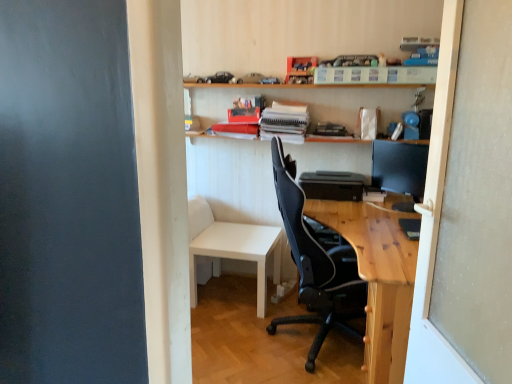
Measure the distance between white matte table at lower center and camera.

white matte table at lower center is 2.73 meters from camera.

Describe the element at coordinates (231, 247) in the screenshot. The image size is (512, 384). I see `white matte table at lower center` at that location.

Image resolution: width=512 pixels, height=384 pixels. In order to click on wooden shelf at upper center in this screenshot , I will do `click(307, 101)`.

Where is `black mesh chair at center`? black mesh chair at center is located at coordinates (316, 264).

What do you see at coordinates (332, 185) in the screenshot?
I see `black plastic printer at center` at bounding box center [332, 185].

Describe the element at coordinates (467, 206) in the screenshot. I see `transparent glass screen door at right` at that location.

At what (x,y) coordinates should I click in order to perform the action: click on black glossy monitor at upper right. Please return your answer as a coordinate pair (x, y). This screenshot has height=384, width=512. Looking at the image, I should click on (399, 167).

This screenshot has width=512, height=384. What are the coordinates of `printer lying on the right of black mesh chair at center` in the screenshot? It's located at (332, 185).

Considering the relative sizes of black mesh chair at center and black plastic printer at center in the image provided, is black mesh chair at center smaller than black plastic printer at center?

Incorrect, black mesh chair at center is not smaller in size than black plastic printer at center.

Which object is further away from the camera, black mesh chair at center or black plastic printer at center?

black plastic printer at center is further from the camera.

Can you tell me how much black mesh chair at center and black plastic printer at center differ in facing direction?

107 degrees.

Between natural wood desk at center and black glossy monitor at upper right, which one has larger width?

natural wood desk at center.

Who is shorter, natural wood desk at center or black glossy monitor at upper right?

black glossy monitor at upper right is shorter.

Consider the image. Is natural wood desk at center not inside black glossy monitor at upper right?

natural wood desk at center is positioned outside black glossy monitor at upper right.

Is wooden shelf at upper center facing away from black glossy monitor at upper right?

wooden shelf at upper center does not have its back to black glossy monitor at upper right.

Which of these two, wooden shelf at upper center or black glossy monitor at upper right, is wider?

wooden shelf at upper center is wider.

In the scene shown: Considering the sizes of objects wooden shelf at upper center and black glossy monitor at upper right in the image provided, who is bigger, wooden shelf at upper center or black glossy monitor at upper right?

With larger size is wooden shelf at upper center.

Does wooden shelf at upper center contain black glossy monitor at upper right?

No, black glossy monitor at upper right is located outside of wooden shelf at upper center.

How different are the orientations of black plastic printer at center and wooden shelf at upper center in degrees?

The angle between the facing direction of black plastic printer at center and the facing direction of wooden shelf at upper center is 0.0613 degrees.

Which is in front, point (314, 187) or point (356, 94)?

The point (314, 187) is closer.

Can you confirm if black plastic printer at center is smaller than wooden shelf at upper center?

Yes.

Consider the image. How distant is black plastic printer at center from wooden shelf at upper center?

A distance of 18.43 inches exists between black plastic printer at center and wooden shelf at upper center.

Would you consider black glossy monitor at upper right to be distant from black mesh chair at center?

No, black glossy monitor at upper right is in close proximity to black mesh chair at center.

Who is smaller, black glossy monitor at upper right or black mesh chair at center?

black glossy monitor at upper right.

From their relative heights in the image, would you say black glossy monitor at upper right is taller or shorter than black mesh chair at center?

Clearly, black glossy monitor at upper right is shorter compared to black mesh chair at center.

Is there a large distance between natural wood desk at center and white matte table at lower center?

natural wood desk at center is near white matte table at lower center, not far away.

Visually, is natural wood desk at center positioned to the left or to the right of white matte table at lower center?

In the image, natural wood desk at center appears on the right side of white matte table at lower center.

From a real-world perspective, is natural wood desk at center below white matte table at lower center?

No, from a real-world perspective, natural wood desk at center is not beneath white matte table at lower center.

From a real-world perspective, which object stands above the other?

wooden shelf at upper center, from a real-world perspective.

Is transparent glass screen door at right far away from wooden shelf at upper center?

Yes, transparent glass screen door at right is far from wooden shelf at upper center.

In the scene shown: Is transparent glass screen door at right oriented towards wooden shelf at upper center?

No, transparent glass screen door at right is not oriented towards wooden shelf at upper center.

Considering the sizes of transparent glass screen door at right and wooden shelf at upper center in the image, is transparent glass screen door at right wider or thinner than wooden shelf at upper center?

Clearly, transparent glass screen door at right has less width compared to wooden shelf at upper center.

Find the location of `chair beneath the black plastic printer at center (from a real-world perspective)`. chair beneath the black plastic printer at center (from a real-world perspective) is located at coordinates (x=316, y=264).

Where is `computer monitor behind the natural wood desk at center`? Image resolution: width=512 pixels, height=384 pixels. computer monitor behind the natural wood desk at center is located at coordinates coord(399,167).

Based on their spatial positions, is wooden shelf at upper center or transparent glass screen door at right closer to white matte table at lower center?

wooden shelf at upper center lies closer to white matte table at lower center than the other object.

When comparing their distances from wooden shelf at upper center, does black mesh chair at center or white matte table at lower center seem further?

black mesh chair at center is further to wooden shelf at upper center.

Considering their positions, is wooden shelf at upper center positioned closer to white paper stack at center than black plastic printer at center?

wooden shelf at upper center is positioned closer to the anchor white paper stack at center.

Based on their spatial positions, is white matte table at lower center or wooden shelf at upper center closer to natural wood desk at center?

white matte table at lower center is closer to natural wood desk at center.

Based on their spatial positions, is white matte table at lower center or black mesh chair at center further from natural wood desk at center?

white matte table at lower center lies further to natural wood desk at center than the other object.

Looking at the image, which one is located further to black mesh chair at center, white paper stack at center or black plastic printer at center?

white paper stack at center lies further to black mesh chair at center than the other object.

Which object lies further to the anchor point black plastic printer at center, natural wood desk at center or wooden shelf at upper center?

wooden shelf at upper center is positioned further to the anchor black plastic printer at center.

Estimate the real-world distances between objects in this image. Which object is further from white paper stack at center, white matte table at lower center or natural wood desk at center?

natural wood desk at center.

Where is `shelf located between natural wood desk at center and white matte table at lower center in the depth direction`? Image resolution: width=512 pixels, height=384 pixels. shelf located between natural wood desk at center and white matte table at lower center in the depth direction is located at coordinates (307, 101).

You are a GUI agent. You are given a task and a screenshot of the screen. Output one action in this format:
    pyautogui.click(x=<x>, y=<y>)
    Task: Click on the chair between natural wood desk at center and white matte table at lower center from front to back
    The width and height of the screenshot is (512, 384).
    Given the screenshot: What is the action you would take?
    pyautogui.click(x=316, y=264)

This screenshot has width=512, height=384. What are the coordinates of `chair located between transparent glass screen door at right and wooden shelf at upper center in the depth direction` in the screenshot? It's located at click(316, 264).

The image size is (512, 384). I want to click on computer monitor positioned between black mesh chair at center and white paper stack at center from near to far, so click(x=399, y=167).